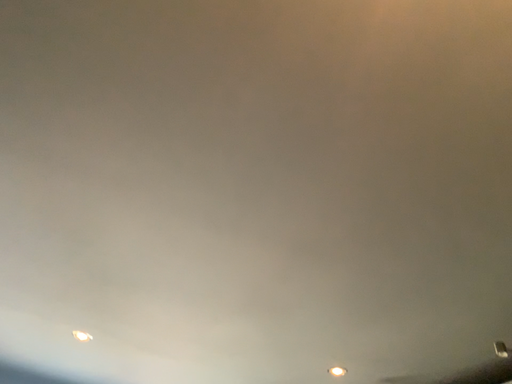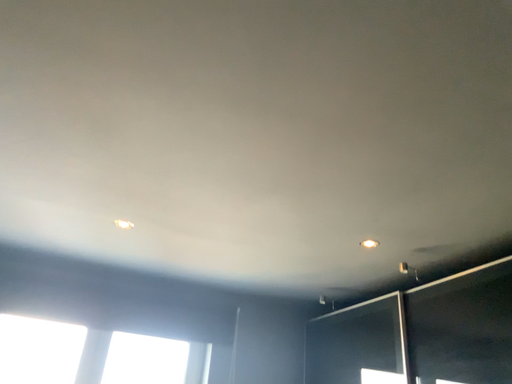
Question: Which way did the camera rotate in the video?

Choices:
 (A) rotated upward
 (B) rotated downward

Answer: (B)